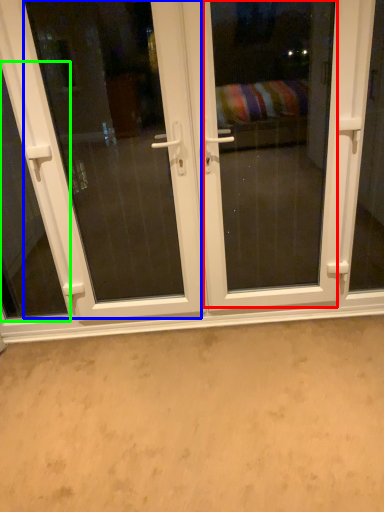
Question: Which object is positioned farthest from screen door (highlighted by a red box)? Select from screen door (highlighted by a blue box) and window (highlighted by a green box).

Choices:
 (A) screen door
 (B) window

Answer: (B)